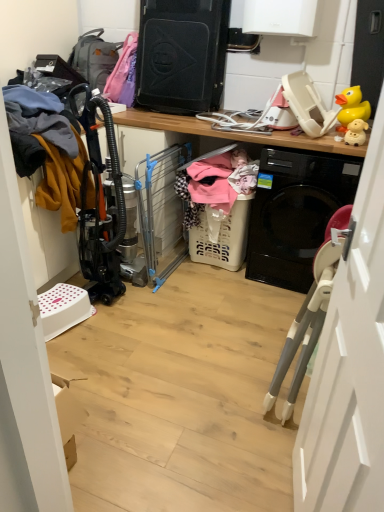
Where is `vacant space that is to the left of yellow rubber toy at upper right, the 1th toy when ordered from bottom to top`? vacant space that is to the left of yellow rubber toy at upper right, the 1th toy when ordered from bottom to top is located at coordinates (335, 141).